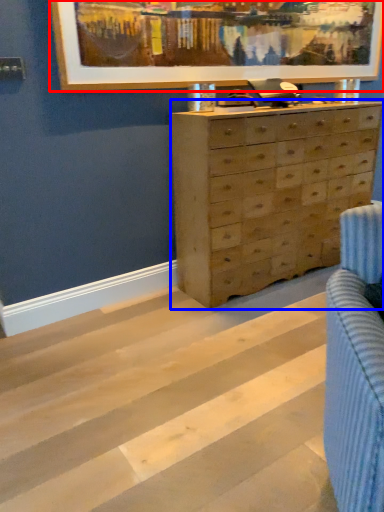
Question: Among these objects, which one is farthest to the camera, picture frame (highlighted by a red box) or chest of drawers (highlighted by a blue box)?

Choices:
 (A) picture frame
 (B) chest of drawers

Answer: (B)